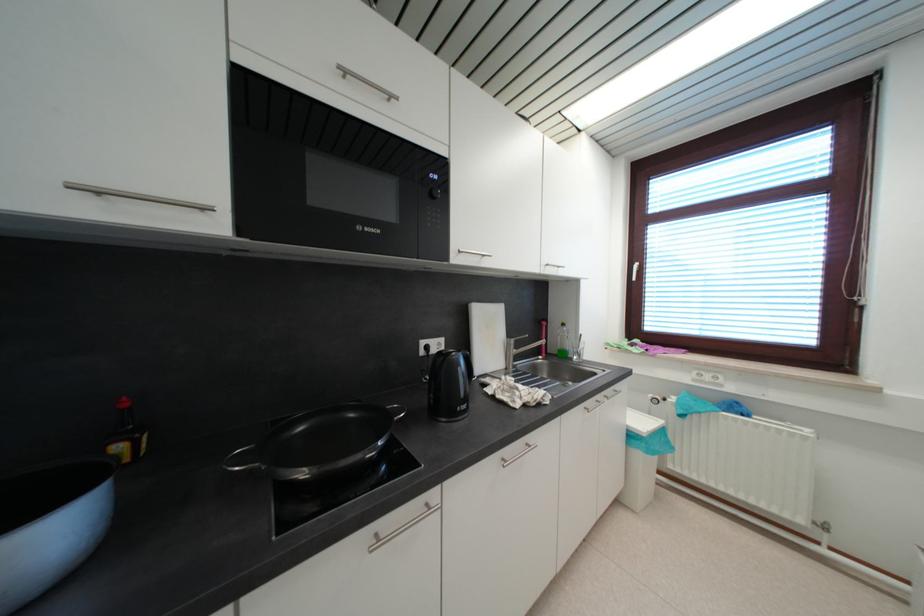
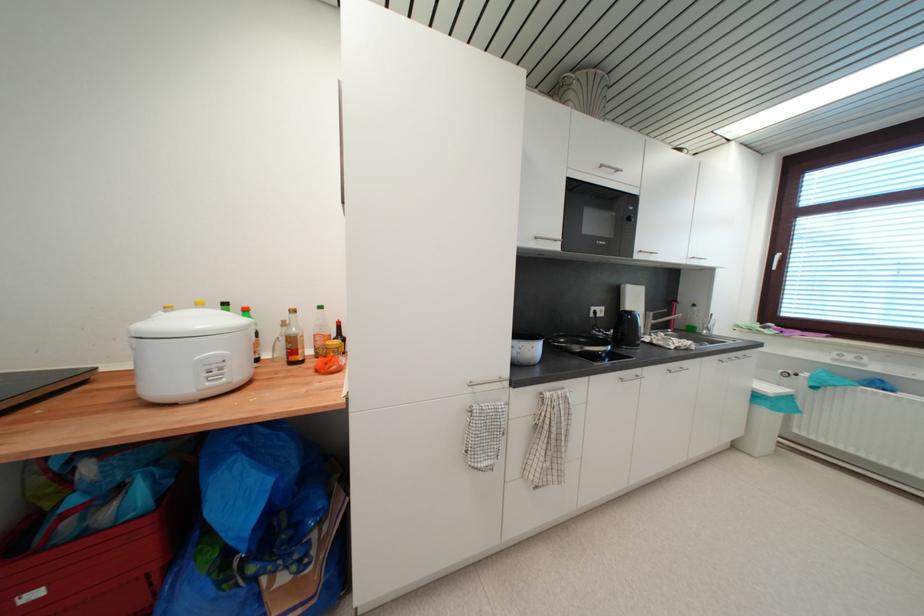
In the second image, find the point that corresponds to (x=574, y=349) in the first image.

(701, 326)